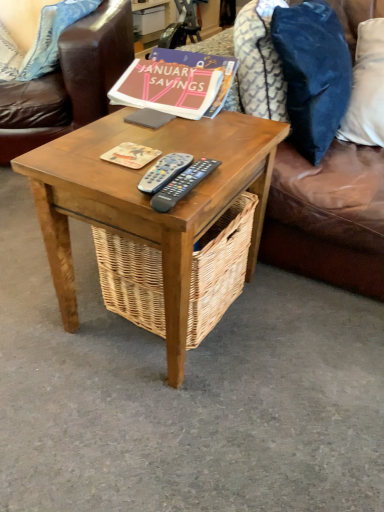
Question: Would you say brown leather couch at upper right is inside or outside blue fabric pillow at upper left, the first pillow in the left-to-right sequence?

Choices:
 (A) outside
 (B) inside

Answer: (A)

Question: Looking at their shapes, would you say brown leather couch at upper right is wider or thinner than blue fabric pillow at upper left, the first pillow in the left-to-right sequence?

Choices:
 (A) thin
 (B) wide

Answer: (B)

Question: Which object is the farthest from the velvety blue pillow at upper right, which is counted as the 1th pillow, starting from the right?

Choices:
 (A) black plastic remote at center, which is the 1th remote control from left to right
 (B) velvety blue pillow at upper right, placed as the 3th pillow when sorted from left to right
 (C) blue fabric pillow at upper left, the 3th pillow from the right
 (D) matte pink paper at upper center, placed as the 1th book when sorted from back to front
 (E) brown leather couch at upper right

Answer: (C)

Question: Estimate the real-world distances between objects in this image. Which object is farther from the velvety blue pillow at upper right, the 4th pillow when ordered from left to right?

Choices:
 (A) black plastic remote control at center, the second remote control viewed from the left
 (B) black plastic remote at center, which is the 2th remote control from right to left
 (C) brown leather couch at upper right
 (D) matte pink paper at upper center, the second book from the bottom
 (E) blue fabric pillow at upper left, the first pillow in the left-to-right sequence

Answer: (E)